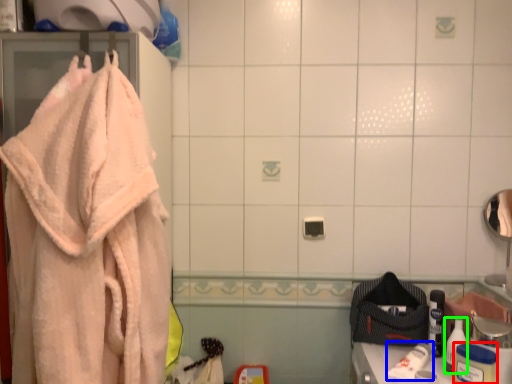
Question: Which object is the farthest from toiletry (highlighted by a red box)? Choose among these: toilet paper (highlighted by a blue box) or toiletry (highlighted by a green box).

Choices:
 (A) toilet paper
 (B) toiletry

Answer: (A)